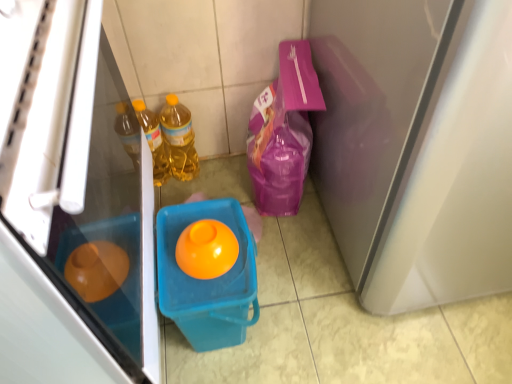
Where is `free space to the right of translucent yellow bottle at left, the second bottle viewed from the right`? free space to the right of translucent yellow bottle at left, the second bottle viewed from the right is located at coordinates (216, 178).